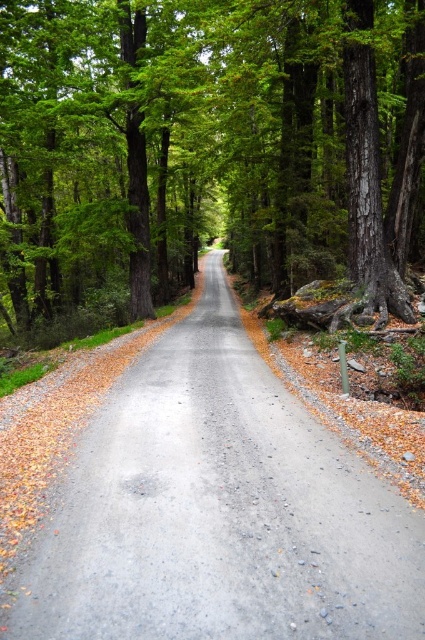
You are a hiker standing on the gray asphalt road at center. Looking ahead, you notice the brown textured tree at center. Based on your position, is the tree located above or below the road?

The brown textured tree at center is above the gray asphalt road at center.